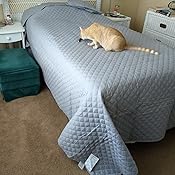
I want to click on items on end tables, so click(x=9, y=20), click(x=2, y=24), click(x=116, y=11).